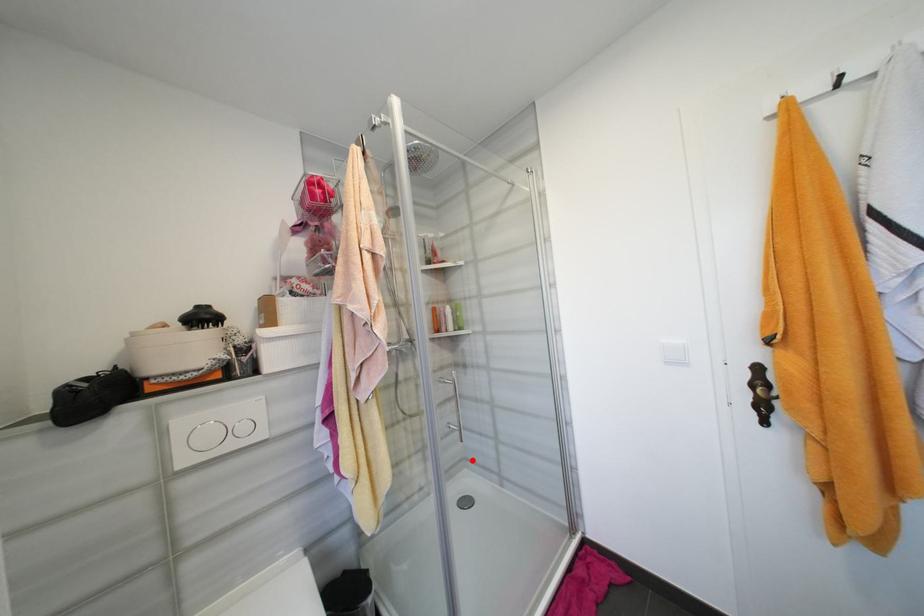
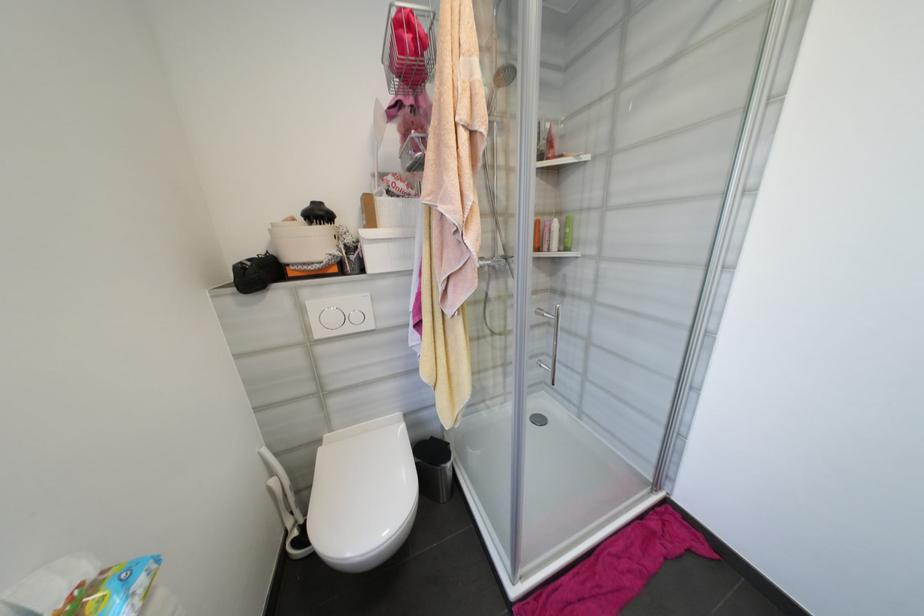
Find the pixel in the second image that matches the highlighted location in the first image.

(552, 384)